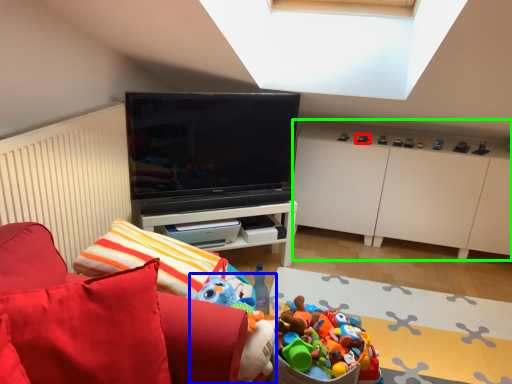
Question: Which is nearer to the toy (highlighted by a red box)? toy (highlighted by a blue box) or cabinetry (highlighted by a green box).

Choices:
 (A) toy
 (B) cabinetry

Answer: (B)